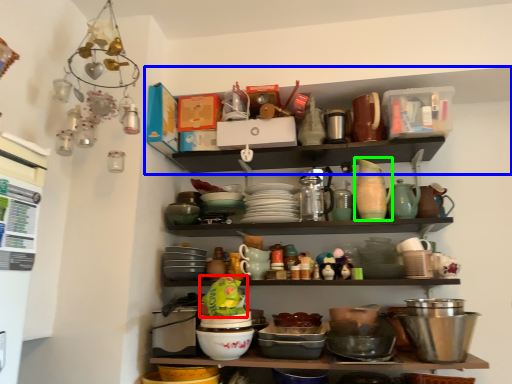
Question: Which object is positioned farthest from food (highlighted by a red box)? Select from shelf (highlighted by a blue box) and tableware (highlighted by a green box).

Choices:
 (A) shelf
 (B) tableware

Answer: (A)